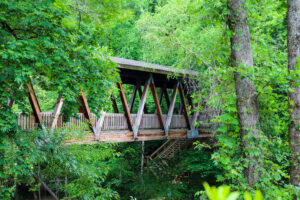
Locate an element on the screen. This screenshot has width=300, height=200. beam is located at coordinates (138, 116).